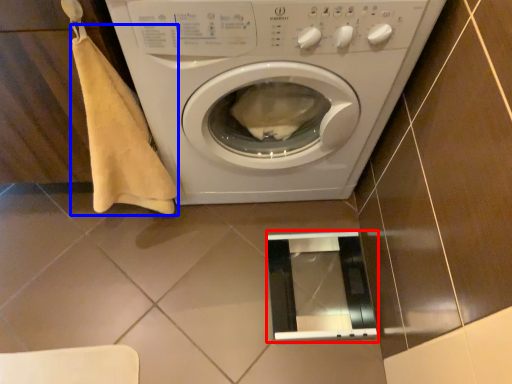
Question: Which object appears closest to the camera in this image, screen door (highlighted by a red box) or blanket (highlighted by a blue box)?

Choices:
 (A) screen door
 (B) blanket

Answer: (B)